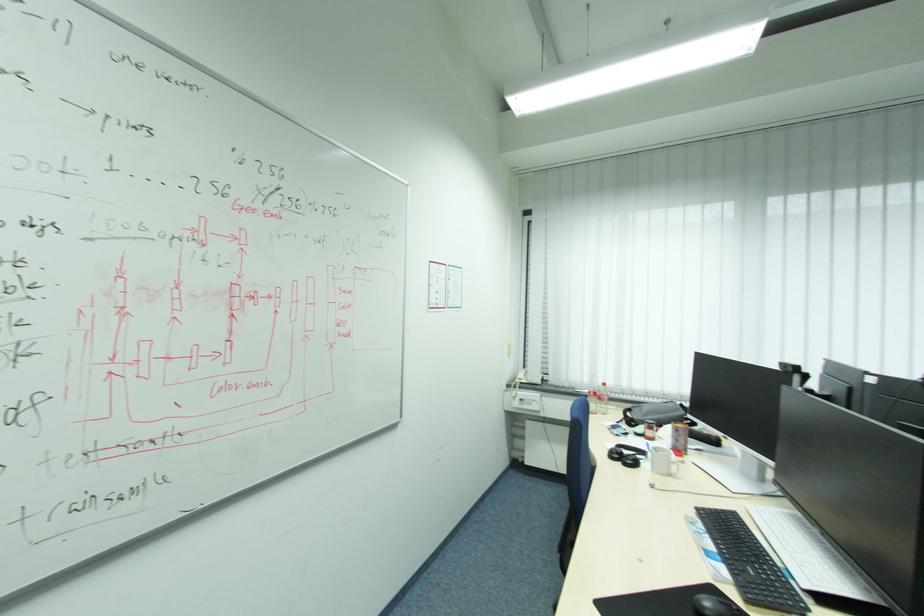
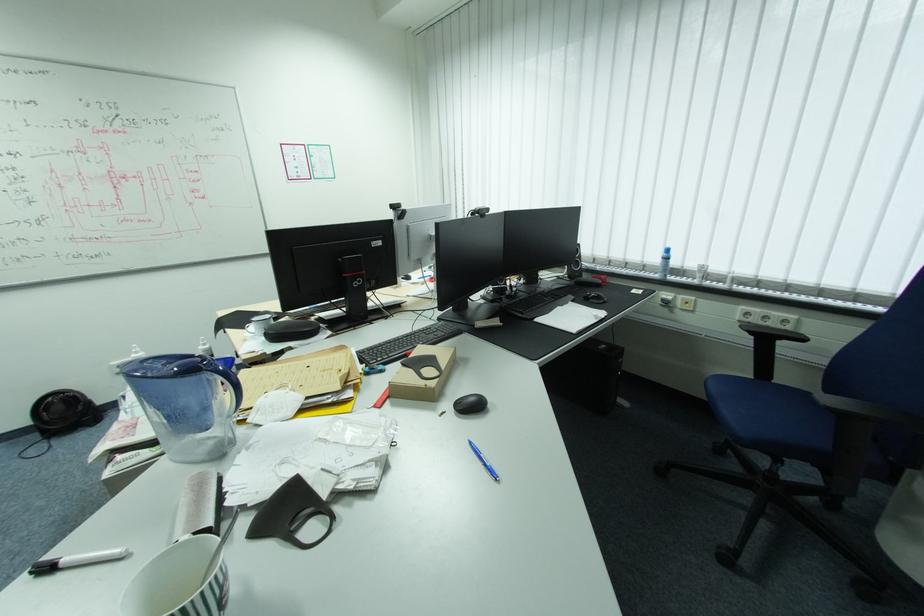
Question: Which direction would the cameraman need to move to produce the second image? Reply with the corresponding letter.

Choices:
 (A) Left
 (B) Right
 (C) Forward
 (D) Backward

Answer: (B)